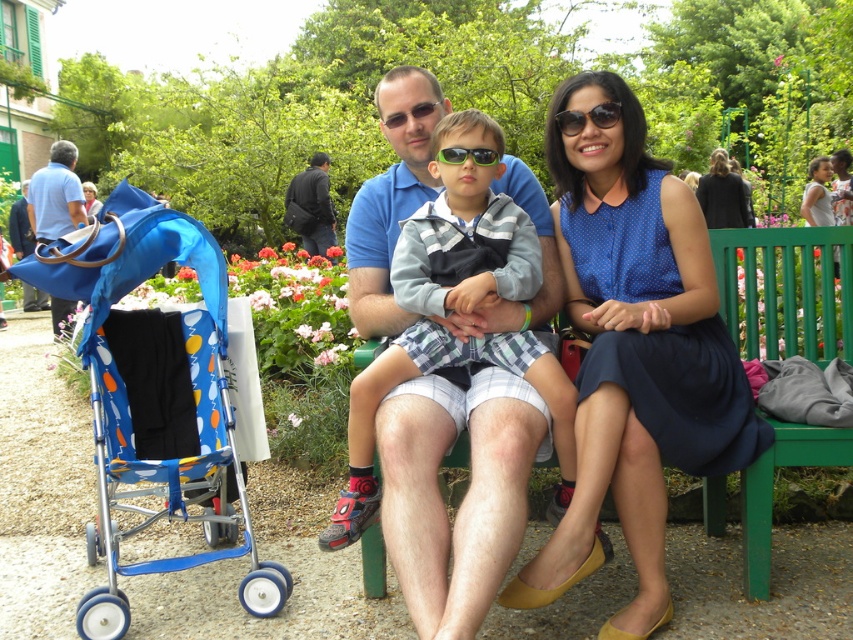
Question: Is dark blue jacket at center below green plastic sunglasses at center?

Choices:
 (A) no
 (B) yes

Answer: (A)

Question: Estimate the real-world distances between objects in this image. Which object is closer to the blue fabric bag at left?

Choices:
 (A) green plastic sunglasses at center
 (B) blue dotted dress at center
 (C) dark blue jacket at center

Answer: (C)

Question: Which point is farther from the camera taking this photo?

Choices:
 (A) (347, 420)
 (B) (436, 156)
 (C) (532, 580)

Answer: (B)

Question: Which object is the closest to the blue dotted dress at center?

Choices:
 (A) blue cotton shirt at center
 (B) blue fabric bag at left
 (C) green plastic sunglasses at center

Answer: (A)

Question: Does blue cotton shirt at center lie behind dark brown hair at center?

Choices:
 (A) yes
 (B) no

Answer: (B)

Question: Can you confirm if dark blue jacket at center is bigger than green plastic sunglasses at center?

Choices:
 (A) yes
 (B) no

Answer: (A)